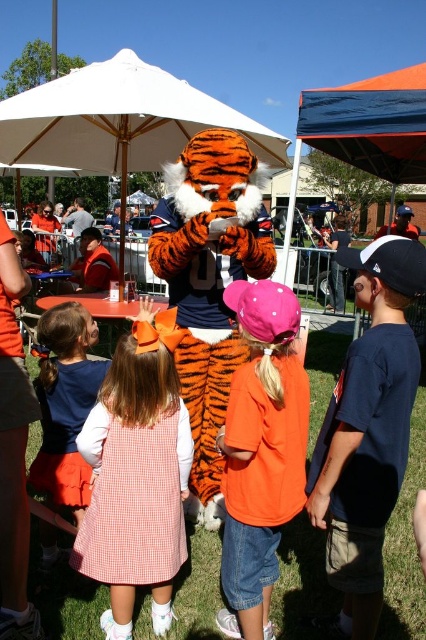
Question: Which point is farther to the camera?

Choices:
 (A) (91, 422)
 (B) (54, 316)
 (C) (317, 120)

Answer: (C)

Question: Can you confirm if blue fabric canopy at upper center is bigger than blue fabric cap at upper right?

Choices:
 (A) yes
 (B) no

Answer: (B)

Question: Does white fabric umbrella at center appear on the right side of orange gingham dress at center?

Choices:
 (A) yes
 (B) no

Answer: (A)

Question: Is orange plush tiger at center to the left of orange cotton shirt at center from the viewer's perspective?

Choices:
 (A) no
 (B) yes

Answer: (B)

Question: Among these objects, which one is nearest to the camera?

Choices:
 (A) orange cotton shirt at center
 (B) orange plush tiger at center

Answer: (A)

Question: Which of the following is the closest to the observer?

Choices:
 (A) orange plush tiger at center
 (B) blue fabric cap at upper right
 (C) white fabric umbrella at center

Answer: (A)